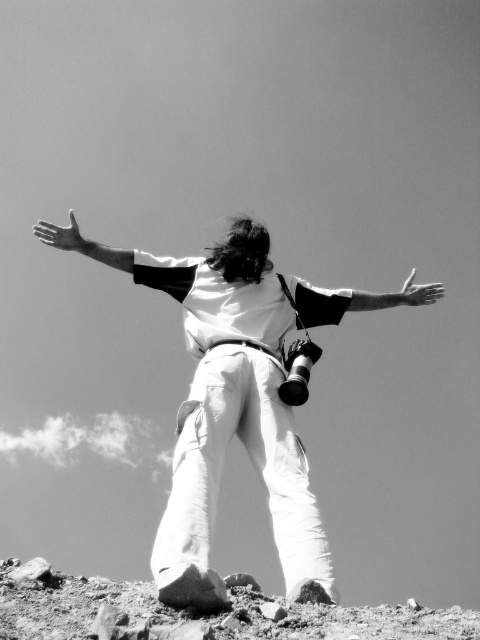
Between smooth white arm at center and white matte hand at upper center, which one appears on the right side from the viewer's perspective?

white matte hand at upper center

Does point (297, 282) come farther from viewer compared to point (387, 296)?

No, (297, 282) is in front of (387, 296).

Locate an element on the screen. The height and width of the screenshot is (640, 480). smooth white arm at center is located at coordinates (357, 300).

Does dirt/rock at lower center appear on the right side of white matte hand at upper center?

In fact, dirt/rock at lower center is to the left of white matte hand at upper center.

Does dirt/rock at lower center appear on the left side of white matte hand at upper center?

Yes, dirt/rock at lower center is to the left of white matte hand at upper center.

Identify the location of dirt/rock at lower center. This screenshot has height=640, width=480. (196, 618).

Is smooth white arm at center smaller than matte white hand at upper left?

Yes.

Is smooth white arm at center positioned before matte white hand at upper left?

Yes, smooth white arm at center is closer to the viewer.

Does point (391, 301) come farther from viewer compared to point (55, 228)?

Yes, it is behind point (55, 228).

This screenshot has height=640, width=480. What are the coordinates of `smooth white arm at center` in the screenshot? It's located at pyautogui.click(x=357, y=300).